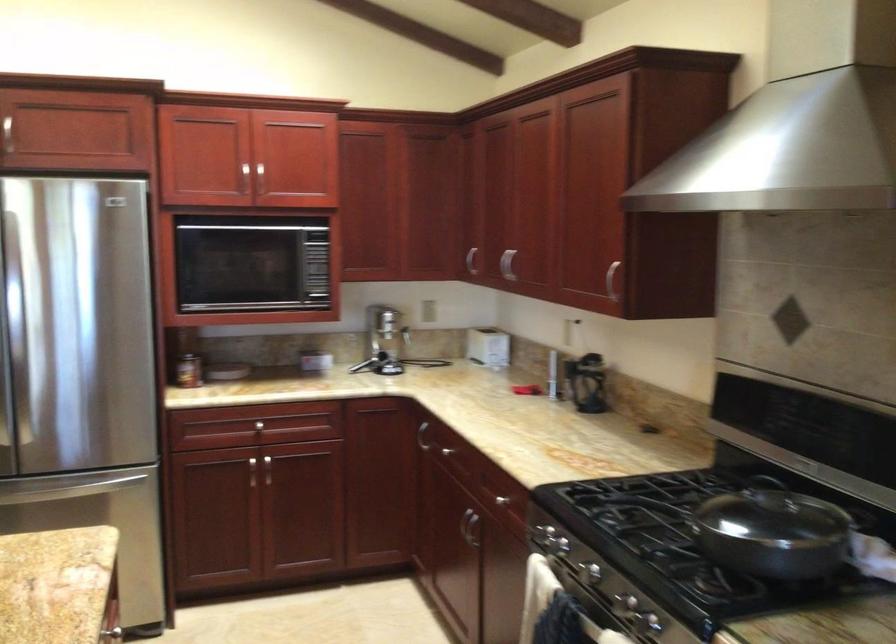
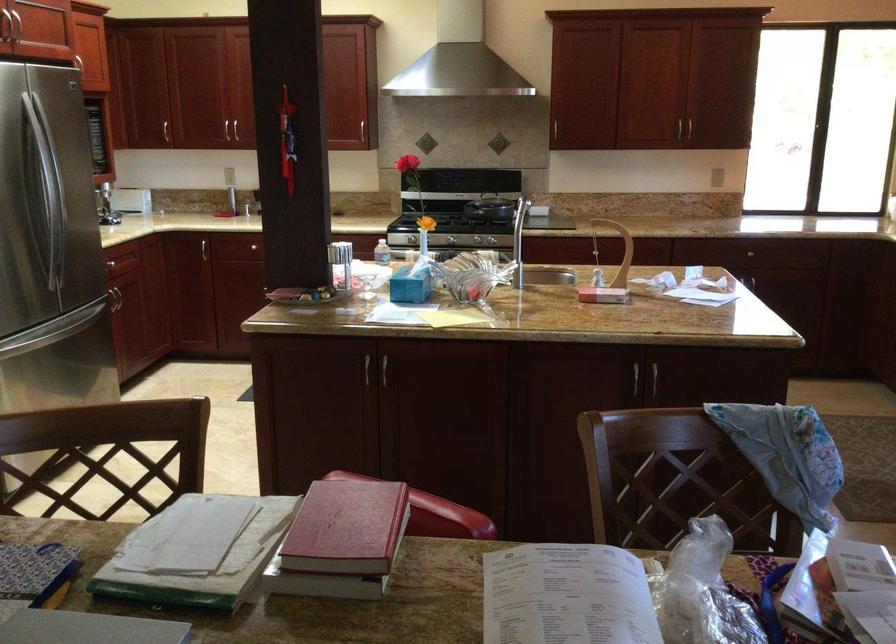
Question: I am providing you with two images of the same scene from different viewpoints. Which of the following objects are not visible in image2?

Choices:
 (A) black stove knob
 (B) small plastic bottle
 (C) silver cabinet handle
 (D) storage box handle

Answer: (C)